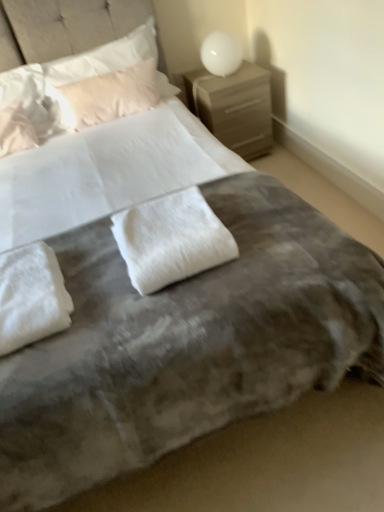
Question: Is white fluffy pillow at upper left, which ranks as the fourth pillow in back-to-front order, to the left or to the right of white fluffy pillow at lower left, the 6th pillow positioned from the back, in the image?

Choices:
 (A) right
 (B) left

Answer: (B)

Question: Does point (6, 122) appear closer or farther from the camera than point (13, 271)?

Choices:
 (A) closer
 (B) farther

Answer: (B)

Question: Which object is positioned farthest from the matte beige nightstand at upper right?

Choices:
 (A) light pink satin pillow at upper left, the sixth pillow positioned from the front
 (B) white fluffy pillow at lower left, the 6th pillow positioned from the back
 (C) white fluffy pillow at upper left, positioned as the 4th pillow in front-to-back order
 (D) white fluffy pillow at upper left, which ranks as the fourth pillow in back-to-front order
 (E) white fluffy pillow at center, positioned as the second pillow in front-to-back order

Answer: (B)

Question: Which of these objects is positioned closest to the matte beige nightstand at upper right?

Choices:
 (A) white fluffy pillow at upper left, which ranks as the fourth pillow in back-to-front order
 (B) white fluffy pillow at center, positioned as the second pillow in front-to-back order
 (C) white glossy sphere at upper right
 (D) light pink satin pillow at upper left, which is counted as the 1th pillow, starting from the back
 (E) white fluffy pillow at lower left, the 6th pillow positioned from the back

Answer: (C)